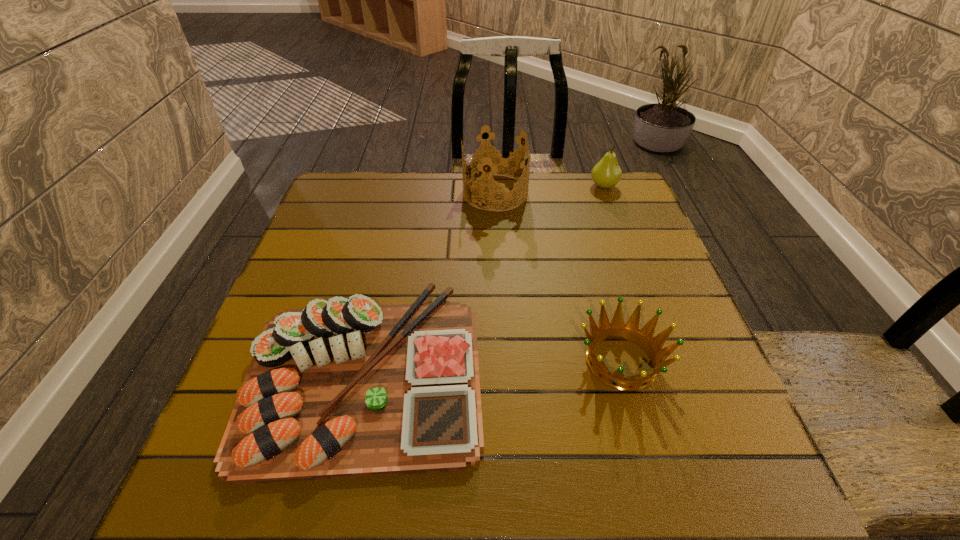
Identify the location of vacant space at the far left corner. The height and width of the screenshot is (540, 960). (364, 174).

Where is `free space at the far right corner of the desktop`? The image size is (960, 540). free space at the far right corner of the desktop is located at coordinates (632, 192).

What are the coordinates of `free spot between the tallest object and the right crown` in the screenshot? It's located at (559, 276).

Image resolution: width=960 pixels, height=540 pixels. In order to click on unoccupied position between the third shortest object and the farther crown in this screenshot , I will do `click(550, 189)`.

Image resolution: width=960 pixels, height=540 pixels. I want to click on free space between the nearer crown and the platter, so click(492, 366).

You are a GUI agent. You are given a task and a screenshot of the screen. Output one action in this format:
    pyautogui.click(x=<x>, y=<y>)
    Task: Click on the vacant region between the platter and the nearer crown
    This screenshot has width=960, height=540.
    Given the screenshot: What is the action you would take?
    pyautogui.click(x=492, y=366)

Where is `empty space that is in between the second tallest object and the platter`? empty space that is in between the second tallest object and the platter is located at coordinates (484, 279).

This screenshot has width=960, height=540. Find the location of `vacant point located between the nearer crown and the tallest object`. vacant point located between the nearer crown and the tallest object is located at coordinates (559, 276).

This screenshot has height=540, width=960. Find the location of `free space that is in between the platter and the second tallest object`. free space that is in between the platter and the second tallest object is located at coordinates (484, 279).

This screenshot has height=540, width=960. In order to click on free area in between the shorter crown and the tallest object in this screenshot , I will do `click(559, 276)`.